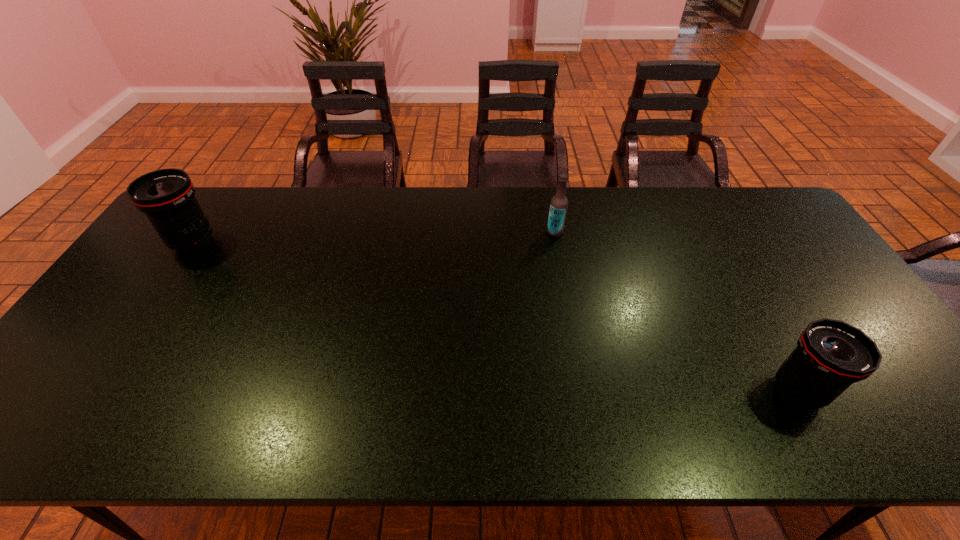
In the image, there is a desktop. In order to click on vacant space at the far right corner in this screenshot , I will do `click(761, 196)`.

This screenshot has height=540, width=960. I want to click on empty location between the beer bottle and the left telephoto lens, so pyautogui.click(x=374, y=237).

This screenshot has height=540, width=960. I want to click on blank region between the nearer telephoto lens and the beer bottle, so click(x=677, y=311).

You are a GUI agent. You are given a task and a screenshot of the screen. Output one action in this format:
    pyautogui.click(x=<x>, y=<y>)
    Task: Click on the vacant space that is in between the beer bottle and the nearest object
    The height and width of the screenshot is (540, 960).
    Given the screenshot: What is the action you would take?
    pyautogui.click(x=677, y=311)

The image size is (960, 540). I want to click on vacant space that is in between the right telephoto lens and the beer bottle, so click(x=677, y=311).

In order to click on empty space that is in between the beer bottle and the rightmost object in this screenshot , I will do `click(677, 311)`.

The height and width of the screenshot is (540, 960). Find the location of `vacant point located between the right telephoto lens and the beer bottle`. vacant point located between the right telephoto lens and the beer bottle is located at coordinates (677, 311).

What are the coordinates of `unoccupied area between the farther telephoto lens and the nearer telephoto lens` in the screenshot? It's located at (495, 316).

At what (x,y) coordinates should I click in order to perform the action: click on unoccupied position between the nearer telephoto lens and the beer bottle. Please return your answer as a coordinate pair (x, y). The height and width of the screenshot is (540, 960). Looking at the image, I should click on (677, 311).

Where is `vacant space in between the beer bottle and the nearer telephoto lens`? The width and height of the screenshot is (960, 540). vacant space in between the beer bottle and the nearer telephoto lens is located at coordinates (677, 311).